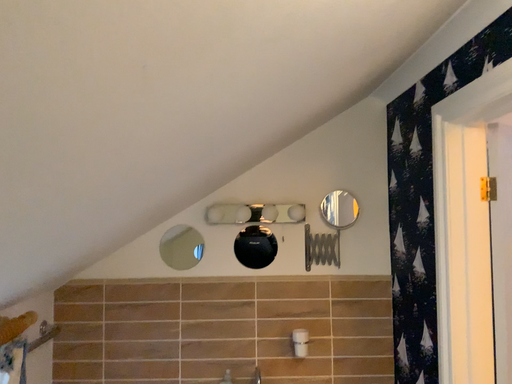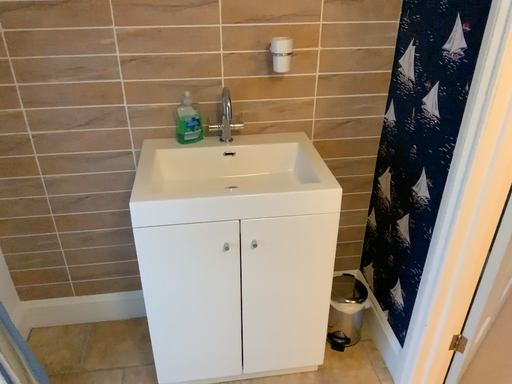
Question: Which way did the camera rotate in the video?

Choices:
 (A) rotated left
 (B) rotated right

Answer: (B)